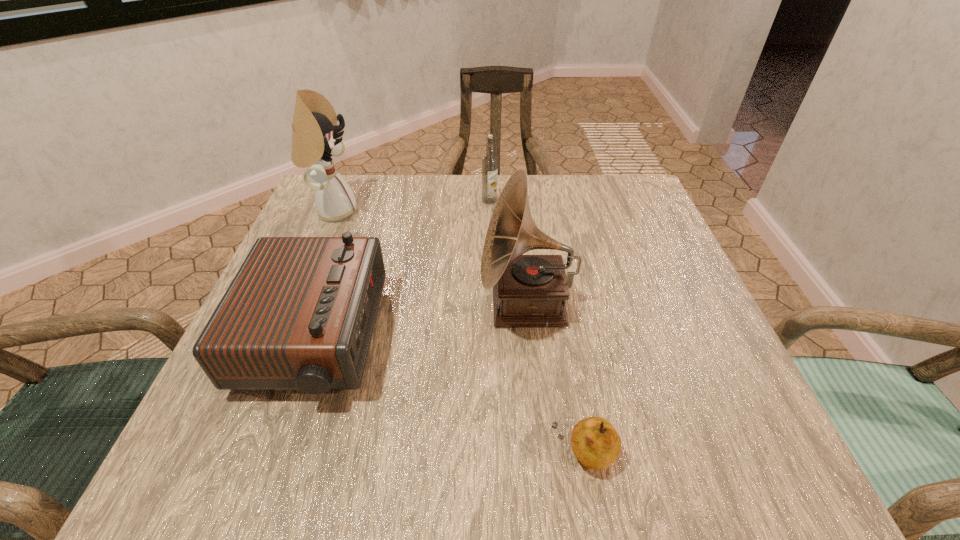
At what (x,y) coordinates should I click in order to perform the action: click on vacant space at the near edge of the desktop. Please return your answer as a coordinate pair (x, y). This screenshot has height=540, width=960. Looking at the image, I should click on (380, 476).

What are the coordinates of `vacant space at the left edge of the desktop` in the screenshot? It's located at (297, 393).

Locate an element on the screen. The width and height of the screenshot is (960, 540). free space at the right edge of the desktop is located at coordinates (651, 289).

In the image, there is a desktop. Identify the location of vacant space at the far left corner. (360, 206).

Image resolution: width=960 pixels, height=540 pixels. I want to click on blank space at the near left corner of the desktop, so click(240, 418).

Identify the location of free region at the far right corner of the desktop. (585, 179).

You are a GUI agent. You are given a task and a screenshot of the screen. Output one action in this format:
    pyautogui.click(x=<x>, y=<y>)
    Task: Click on the vacant area that lies between the phonograph record and the doll
    This screenshot has width=960, height=540.
    Given the screenshot: What is the action you would take?
    pyautogui.click(x=430, y=258)

Locate an element on the screen. free spot between the doll and the shortest object is located at coordinates (458, 333).

The image size is (960, 540). I want to click on free space that is in between the phonograph record and the doll, so click(430, 258).

At what (x,y) coordinates should I click in order to perform the action: click on vacant space in between the phonograph record and the nearest object. Please return your answer as a coordinate pair (x, y). The width and height of the screenshot is (960, 540). Looking at the image, I should click on (555, 379).